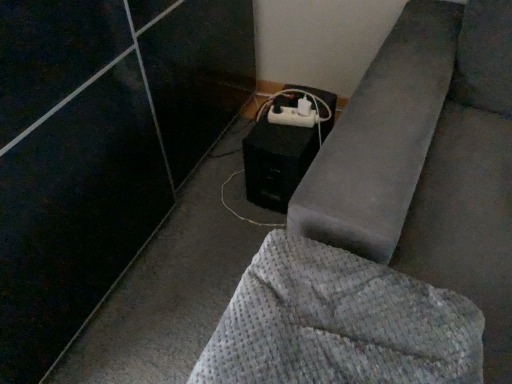
Question: Does point (282, 230) appear closer or farther from the camera than point (262, 167)?

Choices:
 (A) closer
 (B) farther

Answer: (A)

Question: Considering the positions of waffle-textured gray blanket at lower right and black matte speaker at lower center in the image, is waffle-textured gray blanket at lower right taller or shorter than black matte speaker at lower center?

Choices:
 (A) short
 (B) tall

Answer: (A)

Question: Considering the real-world distances, which object is closest to the black matte speaker at lower center?

Choices:
 (A) white plastic extension cord at lower center
 (B) waffle-textured gray blanket at lower right

Answer: (A)

Question: Estimate the real-world distances between objects in this image. Which object is closer to the black matte speaker at lower center?

Choices:
 (A) waffle-textured gray blanket at lower right
 (B) white plastic extension cord at lower center

Answer: (B)